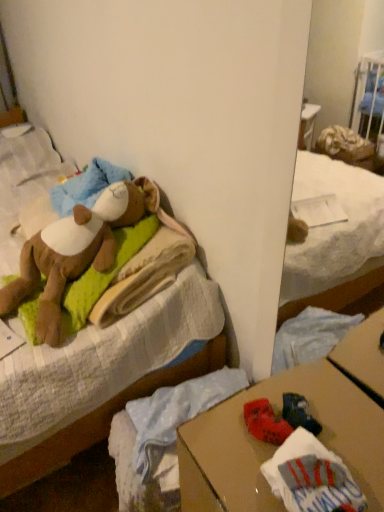
Question: From a real-world perspective, does soft brown teddy bear at upper left sit lower than soft plush bear at upper left?

Choices:
 (A) yes
 (B) no

Answer: (B)

Question: Can you confirm if soft brown teddy bear at upper left is wider than soft plush bear at upper left?

Choices:
 (A) no
 (B) yes

Answer: (A)

Question: From the image's perspective, does soft brown teddy bear at upper left appear lower than soft plush bear at upper left?

Choices:
 (A) yes
 (B) no

Answer: (A)

Question: Is soft brown teddy bear at upper left shorter than soft plush bear at upper left?

Choices:
 (A) yes
 (B) no

Answer: (A)

Question: Is soft brown teddy bear at upper left not within soft plush bear at upper left?

Choices:
 (A) no
 (B) yes

Answer: (A)

Question: Is soft brown teddy bear at upper left facing towards soft plush bear at upper left?

Choices:
 (A) yes
 (B) no

Answer: (A)

Question: Is soft plush bear at upper left aimed at soft brown teddy bear at upper left?

Choices:
 (A) yes
 (B) no

Answer: (B)

Question: Is soft plush bear at upper left at the left side of soft brown teddy bear at upper left?

Choices:
 (A) no
 (B) yes

Answer: (B)

Question: Does soft plush bear at upper left lie behind soft brown teddy bear at upper left?

Choices:
 (A) no
 (B) yes

Answer: (A)

Question: From a real-world perspective, is soft plush bear at upper left located higher than soft brown teddy bear at upper left?

Choices:
 (A) yes
 (B) no

Answer: (B)

Question: Is soft plush bear at upper left outside of soft brown teddy bear at upper left?

Choices:
 (A) no
 (B) yes

Answer: (B)

Question: Considering the relative sizes of soft plush bear at upper left and soft brown teddy bear at upper left in the image provided, is soft plush bear at upper left thinner than soft brown teddy bear at upper left?

Choices:
 (A) yes
 (B) no

Answer: (B)

Question: Is soft brown teddy bear at upper left oriented towards brown cardboard desk at lower right?

Choices:
 (A) yes
 (B) no

Answer: (B)